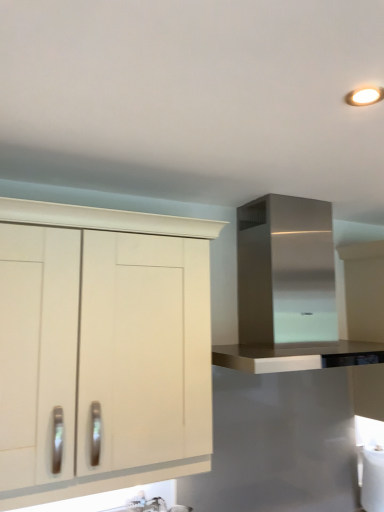
Locate an element on the screen. The width and height of the screenshot is (384, 512). white matte cabinet at left, which is the 2th cabinetry in right-to-left order is located at coordinates (114, 342).

What do you see at coordinates (114, 342) in the screenshot? The image size is (384, 512). I see `white matte cabinet at left, which is the 2th cabinetry in right-to-left order` at bounding box center [114, 342].

Measure the distance between point [143,284] and camera.

The depth of point [143,284] is 1.37 meters.

I want to click on stainless steel range hood at upper right, placed as the 2th cabinetry when sorted from left to right, so click(x=288, y=291).

Describe the element at coordinates (288, 291) in the screenshot. This screenshot has width=384, height=512. I see `stainless steel range hood at upper right, the first cabinetry in the right-to-left sequence` at that location.

You are a GUI agent. You are given a task and a screenshot of the screen. Output one action in this format:
    pyautogui.click(x=<x>, y=<y>)
    Task: Click on the white matte cabinet at left, which is the 2th cabinetry in right-to-left order
    
    Given the screenshot: What is the action you would take?
    pyautogui.click(x=114, y=342)

Which is more to the right, white matte cabinet at left, which is counted as the 1th cabinetry, starting from the left, or stainless steel range hood at upper right, placed as the 2th cabinetry when sorted from left to right?

Positioned to the right is stainless steel range hood at upper right, placed as the 2th cabinetry when sorted from left to right.

Considering their positions, is white matte cabinet at left, which is the 2th cabinetry in right-to-left order, located in front of or behind stainless steel range hood at upper right, placed as the 2th cabinetry when sorted from left to right?

white matte cabinet at left, which is the 2th cabinetry in right-to-left order, is positioned closer to the viewer than stainless steel range hood at upper right, placed as the 2th cabinetry when sorted from left to right.

Is point (148, 477) closer to viewer compared to point (328, 268)?

That is True.

From the image's perspective, is white matte cabinet at left, which is counted as the 1th cabinetry, starting from the left, under stainless steel range hood at upper right, placed as the 2th cabinetry when sorted from left to right?

Yes, from the image's perspective, white matte cabinet at left, which is counted as the 1th cabinetry, starting from the left, is beneath stainless steel range hood at upper right, placed as the 2th cabinetry when sorted from left to right.

From a real-world perspective, is white matte cabinet at left, which is the 2th cabinetry in right-to-left order, on top of stainless steel range hood at upper right, the first cabinetry in the right-to-left sequence?

Actually, white matte cabinet at left, which is the 2th cabinetry in right-to-left order, is physically below stainless steel range hood at upper right, the first cabinetry in the right-to-left sequence, in the real world.

Considering the sizes of objects white matte cabinet at left, which is the 2th cabinetry in right-to-left order, and stainless steel range hood at upper right, the first cabinetry in the right-to-left sequence, in the image provided, who is thinner, white matte cabinet at left, which is the 2th cabinetry in right-to-left order, or stainless steel range hood at upper right, the first cabinetry in the right-to-left sequence,?

Thinner between the two is white matte cabinet at left, which is the 2th cabinetry in right-to-left order.

Considering the relative sizes of white matte cabinet at left, which is the 2th cabinetry in right-to-left order, and stainless steel range hood at upper right, placed as the 2th cabinetry when sorted from left to right, in the image provided, is white matte cabinet at left, which is the 2th cabinetry in right-to-left order, shorter than stainless steel range hood at upper right, placed as the 2th cabinetry when sorted from left to right,?

Incorrect, the height of white matte cabinet at left, which is the 2th cabinetry in right-to-left order, does not fall short of that of stainless steel range hood at upper right, placed as the 2th cabinetry when sorted from left to right.

Is white matte cabinet at left, which is counted as the 1th cabinetry, starting from the left, bigger than stainless steel range hood at upper right, placed as the 2th cabinetry when sorted from left to right?

Incorrect, white matte cabinet at left, which is counted as the 1th cabinetry, starting from the left, is not larger than stainless steel range hood at upper right, placed as the 2th cabinetry when sorted from left to right.

Is stainless steel range hood at upper right, placed as the 2th cabinetry when sorted from left to right, completely or partially inside white matte cabinet at left, which is the 2th cabinetry in right-to-left order?

No, stainless steel range hood at upper right, placed as the 2th cabinetry when sorted from left to right, is not a part of white matte cabinet at left, which is the 2th cabinetry in right-to-left order.

Would you consider white matte cabinet at left, which is counted as the 1th cabinetry, starting from the left, to be distant from stainless steel range hood at upper right, placed as the 2th cabinetry when sorted from left to right?

Actually, white matte cabinet at left, which is counted as the 1th cabinetry, starting from the left, and stainless steel range hood at upper right, placed as the 2th cabinetry when sorted from left to right, are a little close together.

Is white matte cabinet at left, which is the 2th cabinetry in right-to-left order, looking in the opposite direction of stainless steel range hood at upper right, the first cabinetry in the right-to-left sequence?

No, stainless steel range hood at upper right, the first cabinetry in the right-to-left sequence, is not at the back of white matte cabinet at left, which is the 2th cabinetry in right-to-left order.

What's the angular difference between white matte cabinet at left, which is counted as the 1th cabinetry, starting from the left, and stainless steel range hood at upper right, the first cabinetry in the right-to-left sequence,'s facing directions?

There is a 0.362-degree angle between the facing directions of white matte cabinet at left, which is counted as the 1th cabinetry, starting from the left, and stainless steel range hood at upper right, the first cabinetry in the right-to-left sequence.

Find the location of a particular element. The height and width of the screenshot is (512, 384). cabinetry below the stainless steel range hood at upper right, the first cabinetry in the right-to-left sequence (from the image's perspective) is located at coordinates (114, 342).

Is stainless steel range hood at upper right, the first cabinetry in the right-to-left sequence, to the left or to the right of white matte cabinet at left, which is counted as the 1th cabinetry, starting from the left, in the image?

In the image, stainless steel range hood at upper right, the first cabinetry in the right-to-left sequence, appears on the right side of white matte cabinet at left, which is counted as the 1th cabinetry, starting from the left.

Is stainless steel range hood at upper right, placed as the 2th cabinetry when sorted from left to right, positioned in front of white matte cabinet at left, which is the 2th cabinetry in right-to-left order?

That is False.

Considering the positions of point (330, 290) and point (44, 369), is point (330, 290) closer or farther from the camera than point (44, 369)?

Point (330, 290) is positioned farther from the camera compared to point (44, 369).

From the image's perspective, which object appears higher, stainless steel range hood at upper right, placed as the 2th cabinetry when sorted from left to right, or white matte cabinet at left, which is the 2th cabinetry in right-to-left order?

stainless steel range hood at upper right, placed as the 2th cabinetry when sorted from left to right, is shown above in the image.

From a real-world perspective, relative to white matte cabinet at left, which is counted as the 1th cabinetry, starting from the left, is stainless steel range hood at upper right, the first cabinetry in the right-to-left sequence, vertically above or below?

In terms of real-world spatial position, stainless steel range hood at upper right, the first cabinetry in the right-to-left sequence, is above white matte cabinet at left, which is counted as the 1th cabinetry, starting from the left.

Which object is thinner, stainless steel range hood at upper right, the first cabinetry in the right-to-left sequence, or white matte cabinet at left, which is counted as the 1th cabinetry, starting from the left?

With smaller width is white matte cabinet at left, which is counted as the 1th cabinetry, starting from the left.

Who is taller, stainless steel range hood at upper right, the first cabinetry in the right-to-left sequence, or white matte cabinet at left, which is counted as the 1th cabinetry, starting from the left?

With more height is white matte cabinet at left, which is counted as the 1th cabinetry, starting from the left.

Looking at this image, between stainless steel range hood at upper right, the first cabinetry in the right-to-left sequence, and white matte cabinet at left, which is the 2th cabinetry in right-to-left order, which one has smaller size?

Smaller between the two is white matte cabinet at left, which is the 2th cabinetry in right-to-left order.

Would you say stainless steel range hood at upper right, the first cabinetry in the right-to-left sequence, is outside white matte cabinet at left, which is counted as the 1th cabinetry, starting from the left?

Yes.

Is stainless steel range hood at upper right, the first cabinetry in the right-to-left sequence, next to white matte cabinet at left, which is the 2th cabinetry in right-to-left order?

No.

Is stainless steel range hood at upper right, placed as the 2th cabinetry when sorted from left to right, facing towards white matte cabinet at left, which is counted as the 1th cabinetry, starting from the left?

No, stainless steel range hood at upper right, placed as the 2th cabinetry when sorted from left to right, does not turn towards white matte cabinet at left, which is counted as the 1th cabinetry, starting from the left.

Locate an element on the screen. The image size is (384, 512). cabinetry that appears above the white matte cabinet at left, which is the 2th cabinetry in right-to-left order (from a real-world perspective) is located at coordinates (288, 291).

The width and height of the screenshot is (384, 512). Identify the location of cabinetry located on the right of white matte cabinet at left, which is the 2th cabinetry in right-to-left order. (288, 291).

Where is `cabinetry below the stainless steel range hood at upper right, placed as the 2th cabinetry when sorted from left to right (from the image's perspective)`? The height and width of the screenshot is (512, 384). cabinetry below the stainless steel range hood at upper right, placed as the 2th cabinetry when sorted from left to right (from the image's perspective) is located at coordinates (114, 342).